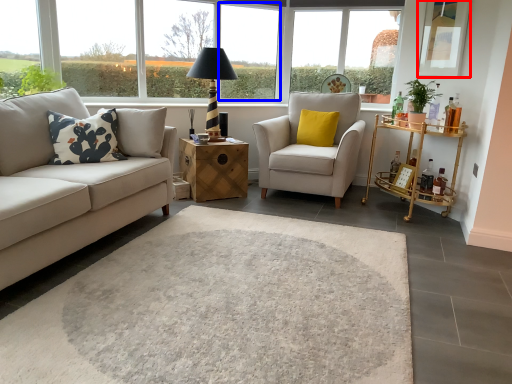
Question: Which point is closer to the camera, window screen (highlighted by a red box) or window frame (highlighted by a blue box)?

Choices:
 (A) window screen
 (B) window frame

Answer: (A)